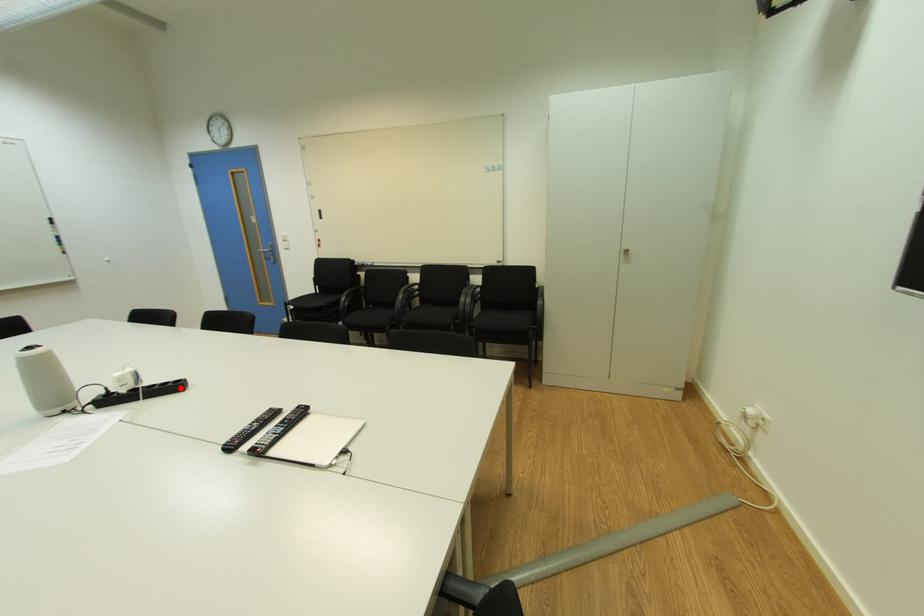
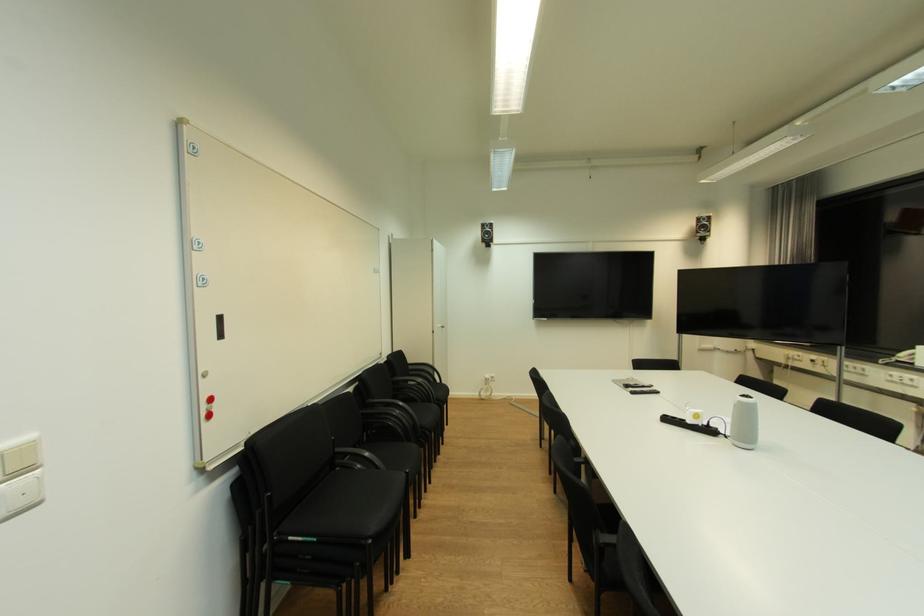
Locate, in the second image, the point that corresponds to the highlighted location in the first image.

(674, 421)